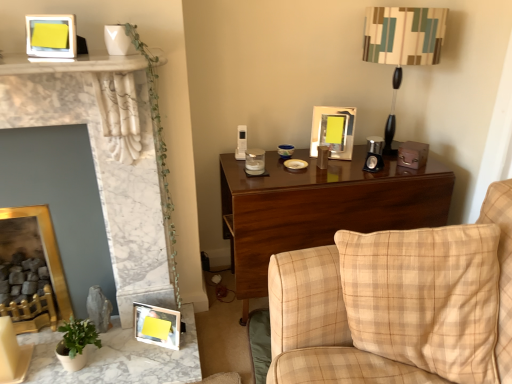
Question: Should I look upward or downward to see beige plaid fabric couch at right?

Choices:
 (A) down
 (B) up

Answer: (A)

Question: Considering the relative sizes of marble table at lower left and metallic silver picture frame at upper center, positioned as the 4th picture frame in left-to-right order, in the image provided, is marble table at lower left shorter than metallic silver picture frame at upper center, positioned as the 4th picture frame in left-to-right order,?

Choices:
 (A) yes
 (B) no

Answer: (A)

Question: Is the position of marble table at lower left more distant than that of metallic silver picture frame at upper center, the first picture frame viewed from the right?

Choices:
 (A) no
 (B) yes

Answer: (A)

Question: From a real-world perspective, is marble table at lower left over metallic silver picture frame at upper center, positioned as the 4th picture frame in left-to-right order?

Choices:
 (A) no
 (B) yes

Answer: (A)

Question: Is marble table at lower left taller than metallic silver picture frame at upper center, positioned as the 4th picture frame in left-to-right order?

Choices:
 (A) yes
 (B) no

Answer: (B)

Question: Is marble table at lower left to the right of metallic silver picture frame at upper center, the 2th picture frame positioned from the top, from the viewer's perspective?

Choices:
 (A) yes
 (B) no

Answer: (B)

Question: Does marble table at lower left turn towards metallic silver picture frame at upper center, which is the 3th picture frame from bottom to top?

Choices:
 (A) no
 (B) yes

Answer: (A)

Question: Can you confirm if green matte plant at lower left is wider than striped fabric lampshade at upper right?

Choices:
 (A) no
 (B) yes

Answer: (A)

Question: Is green matte plant at lower left positioned behind striped fabric lampshade at upper right?

Choices:
 (A) no
 (B) yes

Answer: (A)

Question: Are green matte plant at lower left and striped fabric lampshade at upper right making contact?

Choices:
 (A) yes
 (B) no

Answer: (B)

Question: From a real-world perspective, is green matte plant at lower left under striped fabric lampshade at upper right?

Choices:
 (A) no
 (B) yes

Answer: (B)

Question: From a real-world perspective, is green matte plant at lower left physically above striped fabric lampshade at upper right?

Choices:
 (A) yes
 (B) no

Answer: (B)

Question: Can you confirm if green matte plant at lower left is positioned to the left of striped fabric lampshade at upper right?

Choices:
 (A) no
 (B) yes

Answer: (B)

Question: Considering the relative positions of metallic silver picture frame at upper center, which is the 3th picture frame from bottom to top, and white marble fireplace at left in the image provided, is metallic silver picture frame at upper center, which is the 3th picture frame from bottom to top, behind white marble fireplace at left?

Choices:
 (A) yes
 (B) no

Answer: (A)